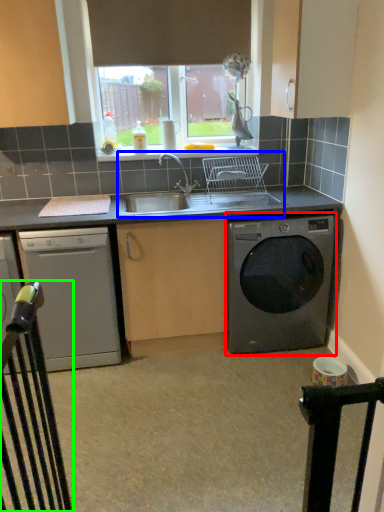
Question: Which is farther away from washing machine (highlighted by a red box)? sink (highlighted by a blue box) or rail (highlighted by a green box)?

Choices:
 (A) sink
 (B) rail

Answer: (B)